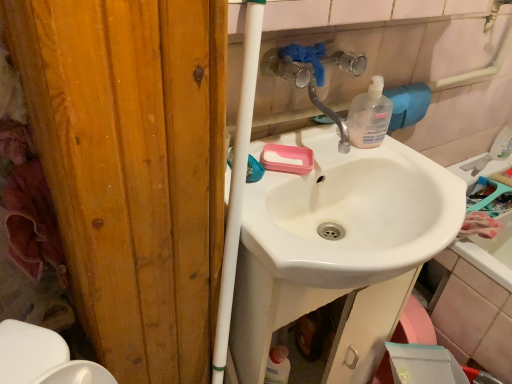
The height and width of the screenshot is (384, 512). I want to click on vacant area that is situated to the right of translucent plastic soap dispenser at upper right, so click(408, 155).